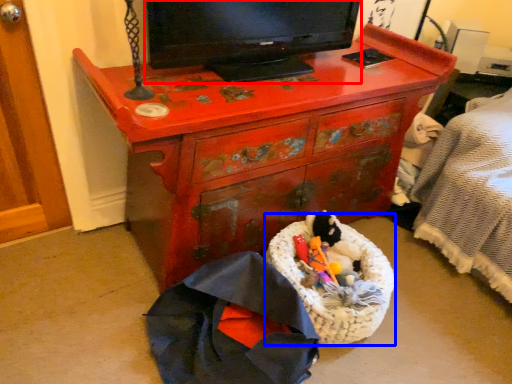
Question: Which object is further to the camera taking this photo, television (highlighted by a red box) or laundry basket (highlighted by a blue box)?

Choices:
 (A) television
 (B) laundry basket

Answer: (B)